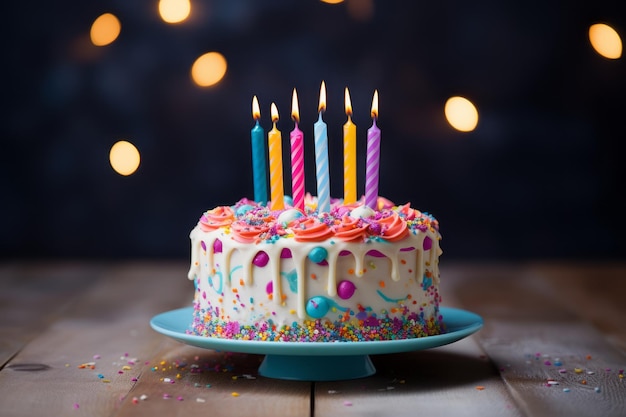
The height and width of the screenshot is (417, 626). What are the coordinates of `lines in wood table` in the screenshot? It's located at (19, 350), (145, 369), (310, 394), (510, 390), (606, 340).